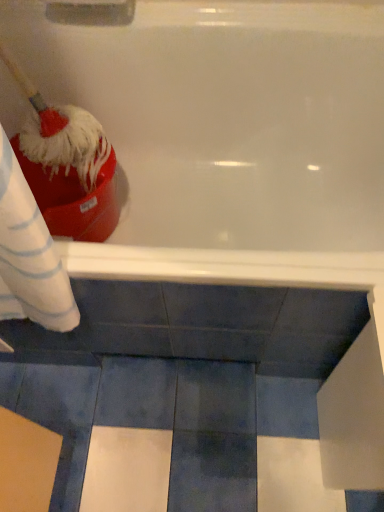
Question: Should I look upward or downward to see red fluffy brush at left?

Choices:
 (A) up
 (B) down

Answer: (A)

Question: From the image's perspective, is white glossy bathtub at upper center beneath red fluffy brush at left?

Choices:
 (A) yes
 (B) no

Answer: (A)

Question: Is white glossy bathtub at upper center at the left side of red fluffy brush at left?

Choices:
 (A) no
 (B) yes

Answer: (A)

Question: Is white glossy bathtub at upper center aimed at red fluffy brush at left?

Choices:
 (A) yes
 (B) no

Answer: (B)

Question: Can we say white glossy bathtub at upper center lies outside red fluffy brush at left?

Choices:
 (A) yes
 (B) no

Answer: (A)

Question: Is white glossy bathtub at upper center smaller than red fluffy brush at left?

Choices:
 (A) yes
 (B) no

Answer: (B)

Question: Does white glossy bathtub at upper center lie in front of red fluffy brush at left?

Choices:
 (A) yes
 (B) no

Answer: (B)

Question: Considering the relative sizes of red fluffy brush at left and white glossy bathtub at upper center in the image provided, is red fluffy brush at left shorter than white glossy bathtub at upper center?

Choices:
 (A) no
 (B) yes

Answer: (B)

Question: Is red fluffy brush at left further to the viewer compared to white glossy bathtub at upper center?

Choices:
 (A) yes
 (B) no

Answer: (B)

Question: Does red fluffy brush at left lie in front of white glossy bathtub at upper center?

Choices:
 (A) no
 (B) yes

Answer: (B)

Question: Can we say red fluffy brush at left lies outside white glossy bathtub at upper center?

Choices:
 (A) no
 (B) yes

Answer: (A)

Question: Considering the relative sizes of red fluffy brush at left and white glossy bathtub at upper center in the image provided, is red fluffy brush at left taller than white glossy bathtub at upper center?

Choices:
 (A) yes
 (B) no

Answer: (B)

Question: Could you tell me if red fluffy brush at left is facing white glossy bathtub at upper center?

Choices:
 (A) no
 (B) yes

Answer: (B)

Question: Considering the positions of white glossy bathtub at upper center and red fluffy brush at left in the image, is white glossy bathtub at upper center wider or thinner than red fluffy brush at left?

Choices:
 (A) wide
 (B) thin

Answer: (A)